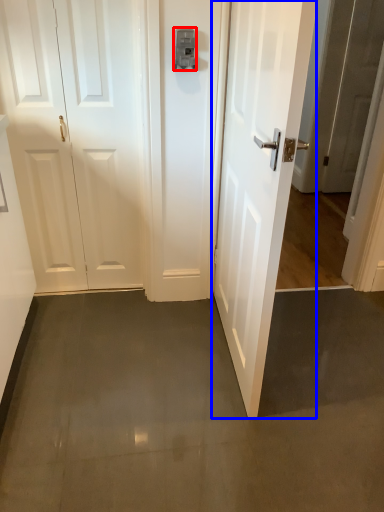
Question: Among these objects, which one is nearest to the camera, latch (highlighted by a red box) or door (highlighted by a blue box)?

Choices:
 (A) latch
 (B) door

Answer: (B)